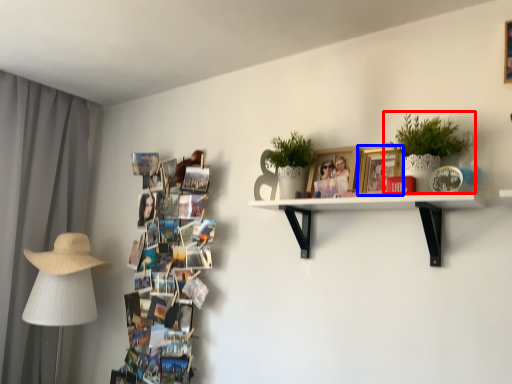
Question: Which of the following is the closest to the observer, houseplant (highlighted by a red box) or picture frame (highlighted by a blue box)?

Choices:
 (A) houseplant
 (B) picture frame

Answer: (A)